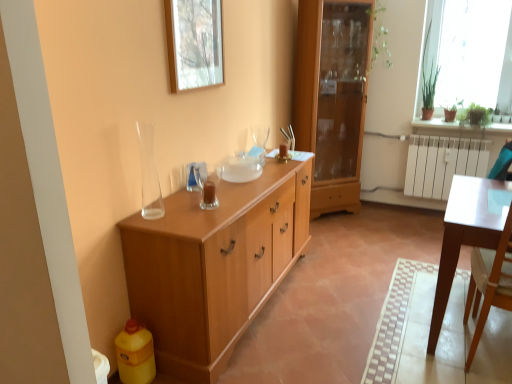
Question: In the image, is transparent glass vase at left positioned in front of or behind wooden cabinet at center?

Choices:
 (A) front
 (B) behind

Answer: (B)

Question: In terms of height, does transparent glass vase at left look taller or shorter compared to wooden cabinet at center?

Choices:
 (A) tall
 (B) short

Answer: (B)

Question: Which of these objects is positioned closest to the translucent glass candle at center?

Choices:
 (A) wooden picture frame at upper center
 (B) transparent glass vase at left
 (C) light brown wood cabinet at center
 (D) wooden cabinet at center
 (E) white glossy table at right

Answer: (B)

Question: Estimate the real-world distances between objects in this image. Which object is closer to the light brown wood cabinet at center?

Choices:
 (A) translucent glass candle at center
 (B) wooden cabinet at center
 (C) transparent glass vase at left
 (D) white glossy table at right
 (E) wooden picture frame at upper center

Answer: (B)